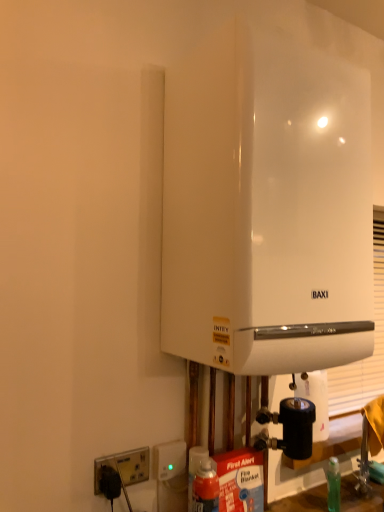
Question: Is white plastic socket at lower left, placed as the first electric outlet when sorted from left to right, to the left or to the right of white glossy boiler at center in the image?

Choices:
 (A) right
 (B) left

Answer: (B)

Question: From the image's perspective, is white plastic socket at lower left, arranged as the second electric outlet when viewed from the right, positioned above or below white glossy boiler at center?

Choices:
 (A) above
 (B) below

Answer: (B)

Question: Considering the real-world distances, which object is closest to the white glossy boiler at center?

Choices:
 (A) white plastic socket at lower left, placed as the first electric outlet when sorted from left to right
 (B) white plastic socket at lower left, the 1th electric outlet in the right-to-left sequence
 (C) white matte paper towel at lower right

Answer: (C)

Question: Based on their relative distances, which object is farther from the white plastic socket at lower left, the 1th electric outlet in the right-to-left sequence?

Choices:
 (A) white glossy boiler at center
 (B) white plastic socket at lower left, placed as the first electric outlet when sorted from left to right
 (C) white matte paper towel at lower right

Answer: (A)